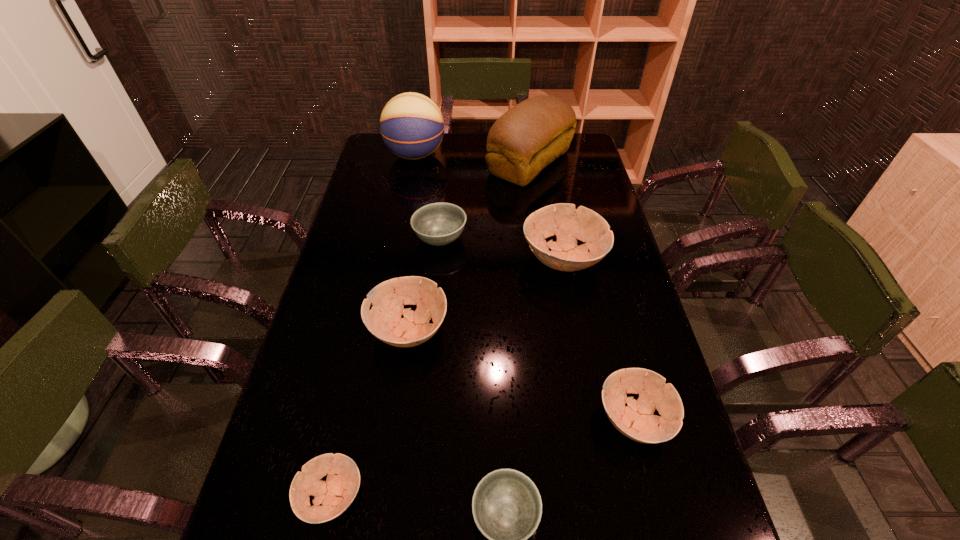
Find the location of a particular element. This screenshot has width=960, height=540. brown bowl object that ranks as the closest to the tallest bowl is located at coordinates (384, 321).

Find the location of a particular element. This screenshot has width=960, height=540. free space that satisfies the following two spatial constraints: 1. on the patterned surface of the blue basketball; 2. on the back side of the third farthest brown bowl is located at coordinates (365, 419).

At what (x,y) coordinates should I click in order to perform the action: click on free space that satisfies the following two spatial constraints: 1. on the front side of the brown bread; 2. on the left side of the farthest brown bowl. Please return your answer as a coordinate pair (x, y). Image resolution: width=960 pixels, height=540 pixels. Looking at the image, I should click on (543, 259).

Identify the location of blank area in the image that satisfies the following two spatial constraints: 1. on the front side of the third farthest brown bowl; 2. on the right side of the second farthest brown bowl. This screenshot has width=960, height=540. (396, 419).